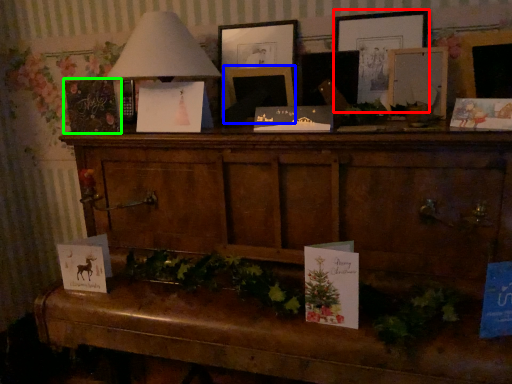
Question: Estimate the real-world distances between objects in this image. Which object is closer to picture frame (highlighted by a red box), picture frame (highlighted by a blue box) or christmas card (highlighted by a green box)?

Choices:
 (A) picture frame
 (B) christmas card

Answer: (A)